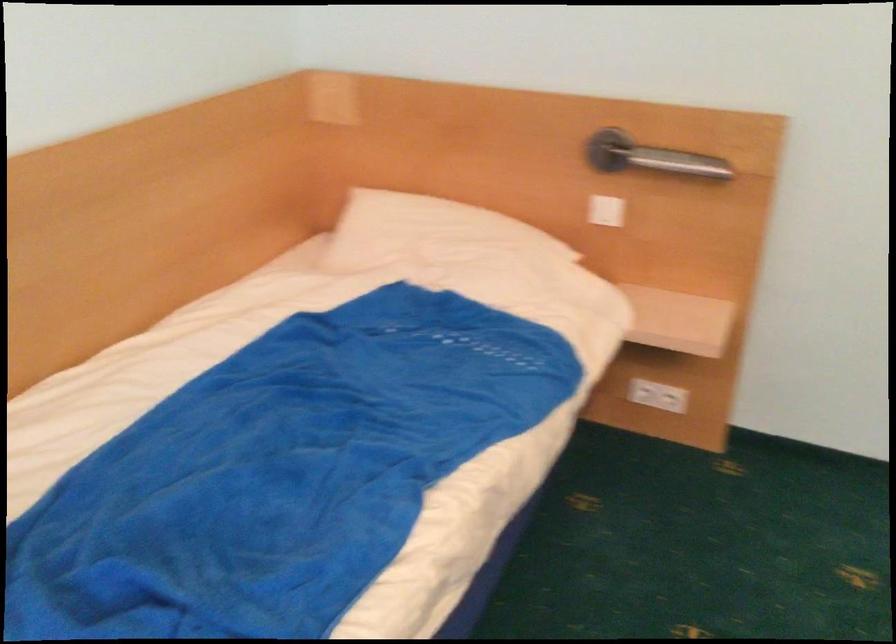
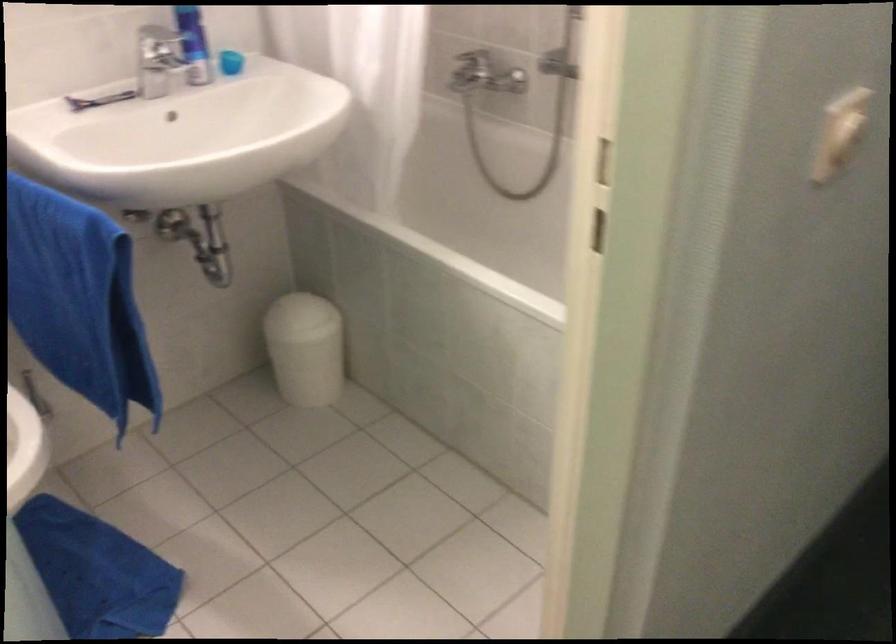
The images are taken continuously from a first-person perspective. In which direction are you moving?

The cameraman walked toward right, forward.